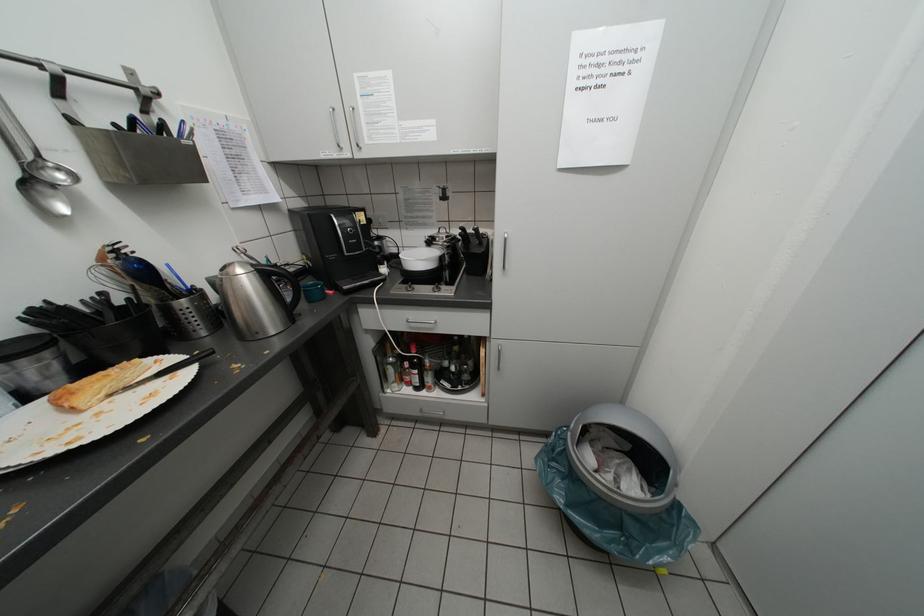
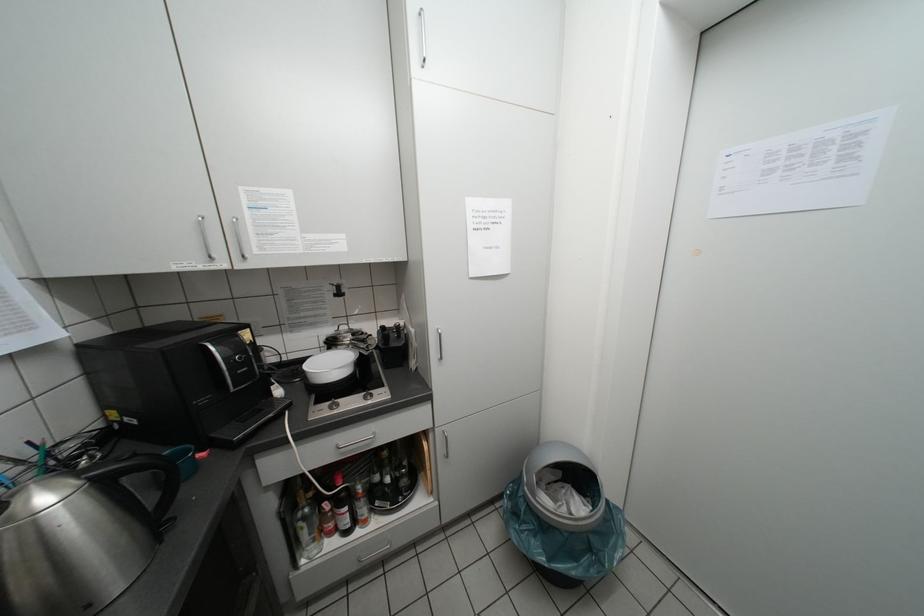
Question: The first image is from the beginning of the video and the second image is from the end. How did the camera likely rotate when shooting the video?

Choices:
 (A) Left
 (B) Right
 (C) Up
 (D) Down

Answer: (B)